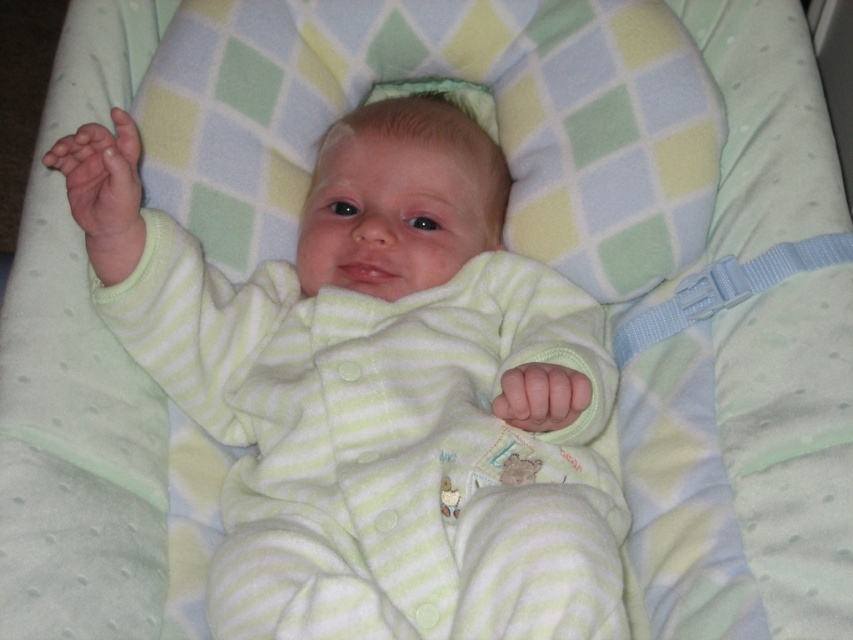
Looking at this image, you are a photographer taking a picture of the baby in the bouncer. You notice two points marked on the image at coordinates point (175, 298) and point (115, 154). Which point is closer to the camera?

Point (175, 298) is further to the camera than point (115, 154), so the point closer to the camera is point (115, 154).

You are a parent looking at the baby in the bouncer. You see the light green striped onesie at center and the transparent plastic teething ring at upper left. Which of these items is positioned higher in the image?

The transparent plastic teething ring at upper left is positioned higher than the light green striped onesie at center.

You are a caregiver checking the baby in the bouncer. You notice the light green striped onesie at center and the transparent plastic teething ring at upper left. Which object is closer to the baby?

The light green striped onesie at center is closer to the baby because it is in front of the transparent plastic teething ring at upper left.